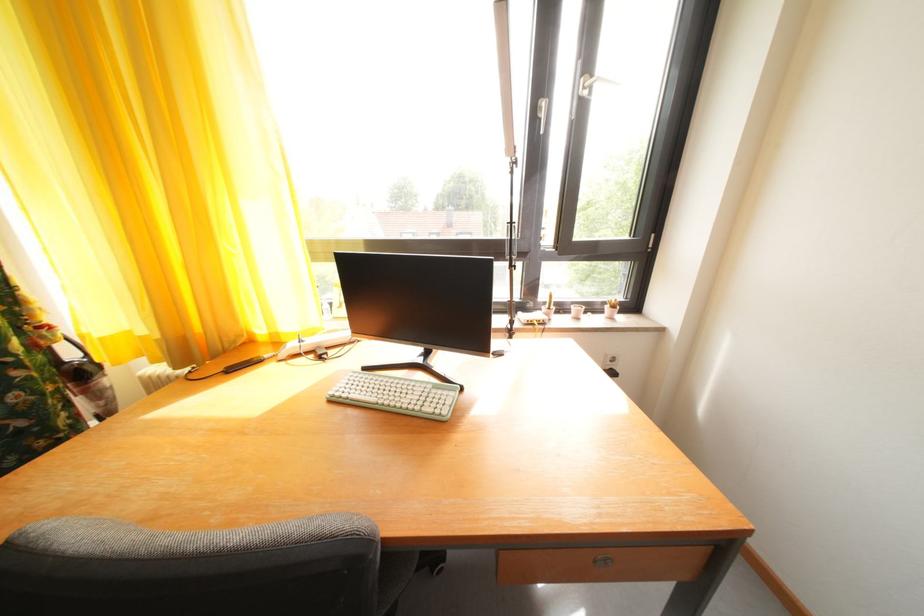
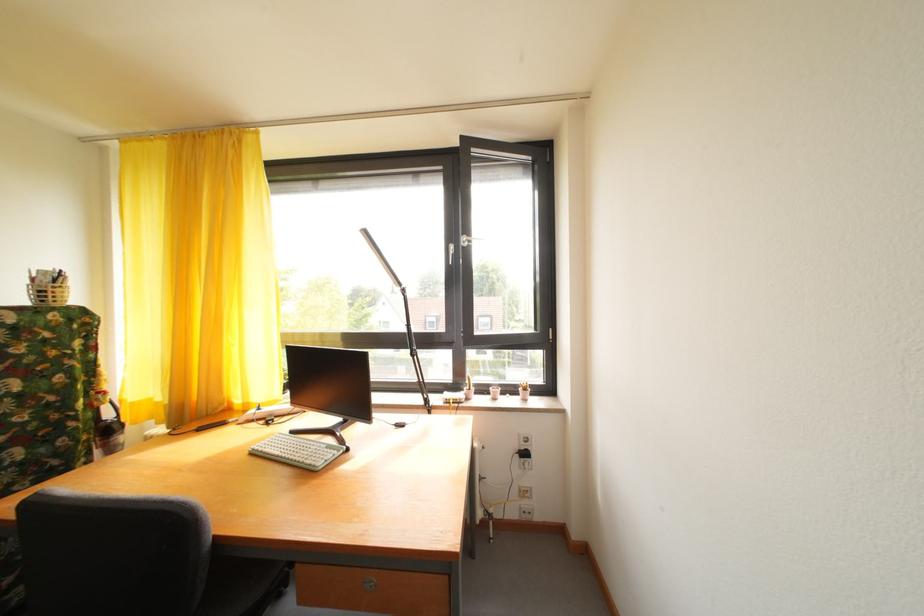
Find the pixel in the second image that matches the point at 570,315 in the first image.

(492, 395)